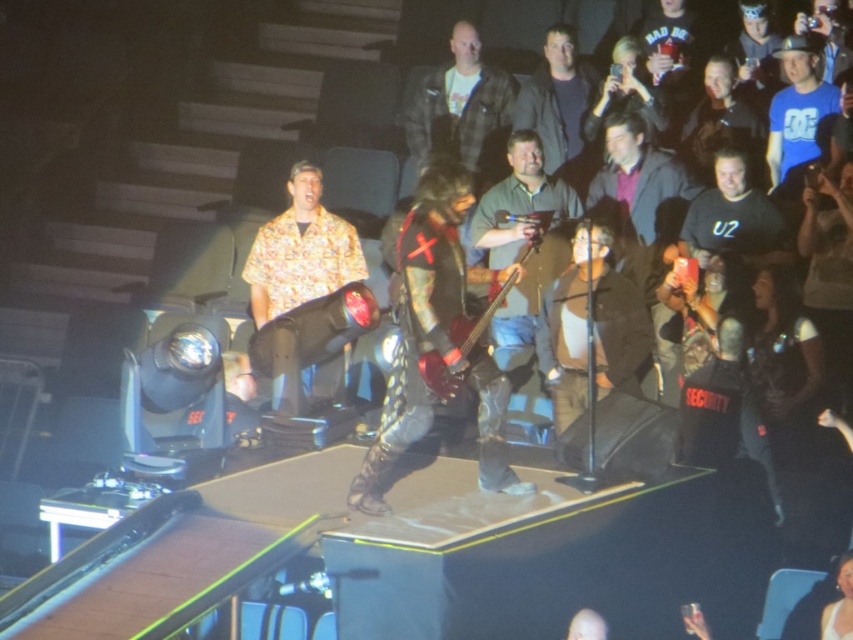
Question: In this image, where is matte brown shirt at center located relative to black cotton shirt at center?

Choices:
 (A) above
 (B) below

Answer: (B)

Question: Can you confirm if matte brown shirt at center is positioned above dark blue shirt at upper center?

Choices:
 (A) no
 (B) yes

Answer: (A)

Question: Which object is the farthest from the leather jacket at upper center?

Choices:
 (A) black cotton shirt at center
 (B) dark blue shirt at upper center

Answer: (A)

Question: Can you confirm if leather jacket at center is bigger than black cotton shirt at center?

Choices:
 (A) no
 (B) yes

Answer: (B)

Question: Which is nearer to the black cotton shirt at center?

Choices:
 (A) leather jacket at upper center
 (B) leather jacket at center

Answer: (A)

Question: Which point is closer to the camera?

Choices:
 (A) matte brown shirt at center
 (B) leather jacket at upper center
 (C) leather jacket at center

Answer: (C)